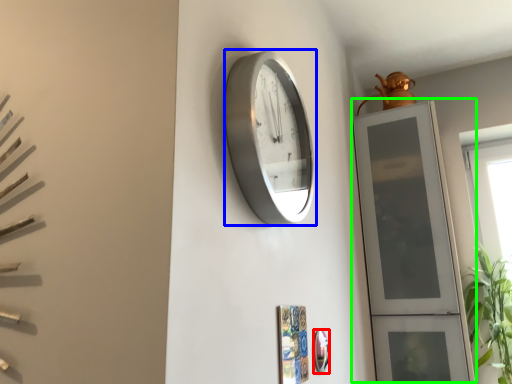
Question: Estimate the real-world distances between objects in this image. Which object is farther from mirror (highlighted by a red box), wall clock (highlighted by a blue box) or glass door (highlighted by a green box)?

Choices:
 (A) wall clock
 (B) glass door

Answer: (B)